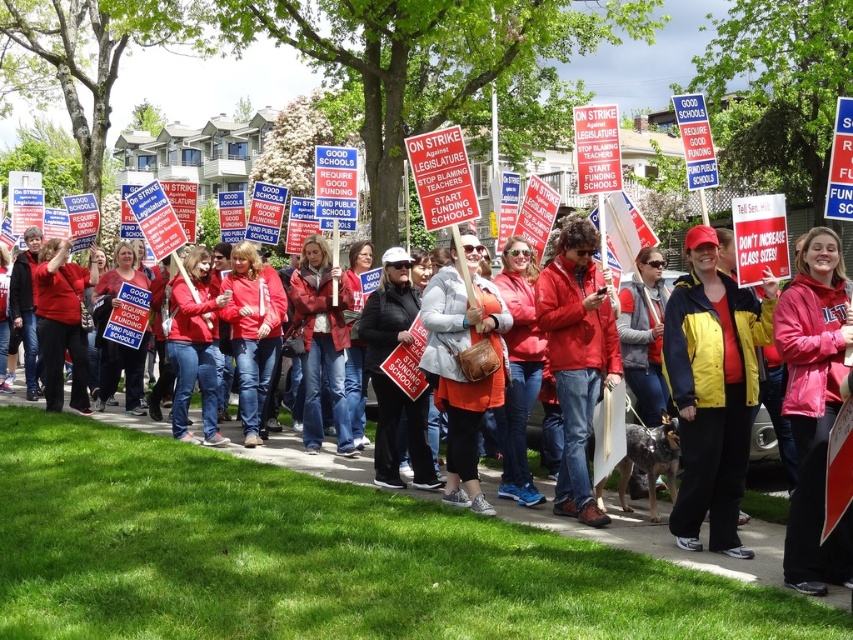
Does yellow jacket at center have a larger size compared to red matte jacket at center?

Yes.

Is point (712, 436) behind point (592, 291)?

No, (712, 436) is in front of (592, 291).

Image resolution: width=853 pixels, height=640 pixels. Find the location of `yellow jacket at center`. yellow jacket at center is located at coordinates (712, 388).

Is point (743, 529) farther from viewer compared to point (453, 444)?

No, it is in front of (453, 444).

Measure the distance between matte red jacket at center and orange fabric jacket at center.

matte red jacket at center is 5.93 feet away from orange fabric jacket at center.

This screenshot has height=640, width=853. Describe the element at coordinates (660, 540) in the screenshot. I see `matte red jacket at center` at that location.

Find the location of a particular element. The image size is (853, 640). matte red jacket at center is located at coordinates (660, 540).

Who is more distant from viewer, [722,397] or [490,296]?

The point [490,296] is behind.

What do you see at coordinates (712, 388) in the screenshot? The width and height of the screenshot is (853, 640). I see `yellow jacket at center` at bounding box center [712, 388].

Is point (682, 456) more distant than point (444, 285)?

That is False.

Where is `yellow jacket at center`? yellow jacket at center is located at coordinates (712, 388).